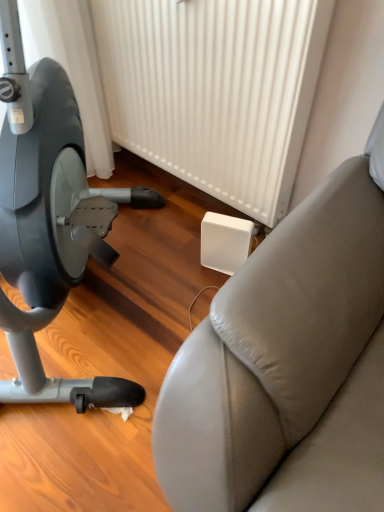
Question: Considering the positions of leather-like studio couch at right and white plastic radiator at center in the image, is leather-like studio couch at right bigger or smaller than white plastic radiator at center?

Choices:
 (A) small
 (B) big

Answer: (A)

Question: From a real-world perspective, relative to white plastic radiator at center, is leather-like studio couch at right vertically above or below?

Choices:
 (A) above
 (B) below

Answer: (B)

Question: Estimate the real-world distances between objects in this image. Which object is farther from the leather-like studio couch at right?

Choices:
 (A) white plastic radiator at center
 (B) matte gray stationary bicycle at left

Answer: (A)

Question: Estimate the real-world distances between objects in this image. Which object is closer to the white plastic radiator at center?

Choices:
 (A) matte gray stationary bicycle at left
 (B) leather-like studio couch at right

Answer: (A)